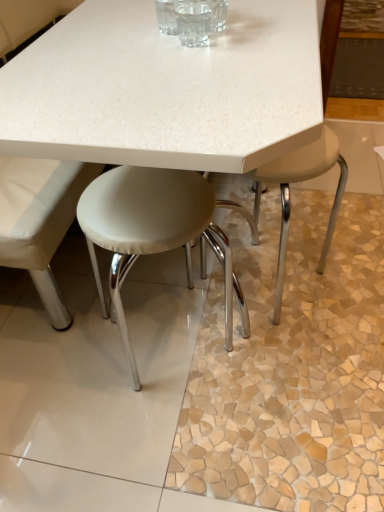
Question: Is transparent glass at center bigger than white leather stool at center, marked as the 2th stool in a right-to-left arrangement?

Choices:
 (A) no
 (B) yes

Answer: (A)

Question: From a real-world perspective, is transparent glass at center below white leather stool at center, marked as the 2th stool in a right-to-left arrangement?

Choices:
 (A) yes
 (B) no

Answer: (B)

Question: Is transparent glass at center taller than white leather stool at center, marked as the 2th stool in a right-to-left arrangement?

Choices:
 (A) no
 (B) yes

Answer: (A)

Question: From a real-world perspective, is transparent glass at center located higher than white leather stool at center, marked as the 2th stool in a right-to-left arrangement?

Choices:
 (A) yes
 (B) no

Answer: (A)

Question: Is transparent glass at center positioned with its back to white leather stool at center, which is the 1th stool in left-to-right order?

Choices:
 (A) yes
 (B) no

Answer: (B)

Question: Is white leather stool at center, which is the 1th stool in left-to-right order, to the left or to the right of beige leather stool at lower right, arranged as the first stool when viewed from the right, in the image?

Choices:
 (A) right
 (B) left

Answer: (B)

Question: From a real-world perspective, is white leather stool at center, marked as the 2th stool in a right-to-left arrangement, above or below beige leather stool at lower right, acting as the second stool starting from the left?

Choices:
 (A) above
 (B) below

Answer: (A)

Question: Is white leather stool at center, which is the 1th stool in left-to-right order, wider or thinner than beige leather stool at lower right, acting as the second stool starting from the left?

Choices:
 (A) thin
 (B) wide

Answer: (B)

Question: Is point (114, 211) positioned closer to the camera than point (289, 190)?

Choices:
 (A) closer
 (B) farther

Answer: (A)

Question: In the image, is beige leather stool at lower right, acting as the second stool starting from the left, on the left side or the right side of white leather stool at center, marked as the 2th stool in a right-to-left arrangement?

Choices:
 (A) right
 (B) left

Answer: (A)

Question: In terms of width, does beige leather stool at lower right, arranged as the first stool when viewed from the right, look wider or thinner when compared to white leather stool at center, marked as the 2th stool in a right-to-left arrangement?

Choices:
 (A) thin
 (B) wide

Answer: (A)

Question: Is beige leather stool at lower right, acting as the second stool starting from the left, taller or shorter than white leather stool at center, which is the 1th stool in left-to-right order?

Choices:
 (A) short
 (B) tall

Answer: (A)

Question: Considering their positions, is beige leather stool at lower right, acting as the second stool starting from the left, located in front of or behind white leather stool at center, which is the 1th stool in left-to-right order?

Choices:
 (A) front
 (B) behind

Answer: (B)

Question: Do you think transparent glass at center is within white leather stool at center, marked as the 2th stool in a right-to-left arrangement, or outside of it?

Choices:
 (A) inside
 (B) outside

Answer: (B)

Question: Considering the positions of transparent glass at center and white leather stool at center, which is the 1th stool in left-to-right order, in the image, is transparent glass at center wider or thinner than white leather stool at center, which is the 1th stool in left-to-right order,?

Choices:
 (A) wide
 (B) thin

Answer: (B)